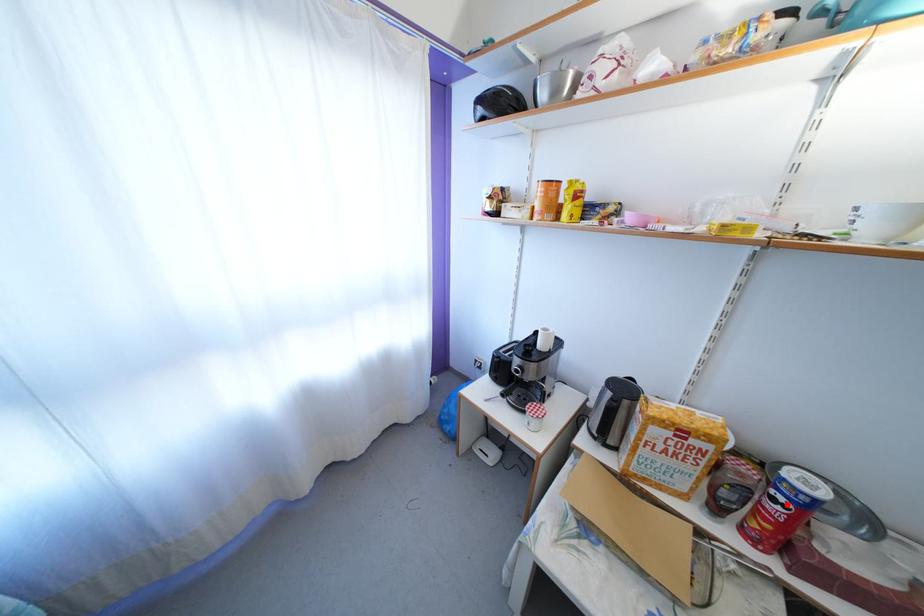
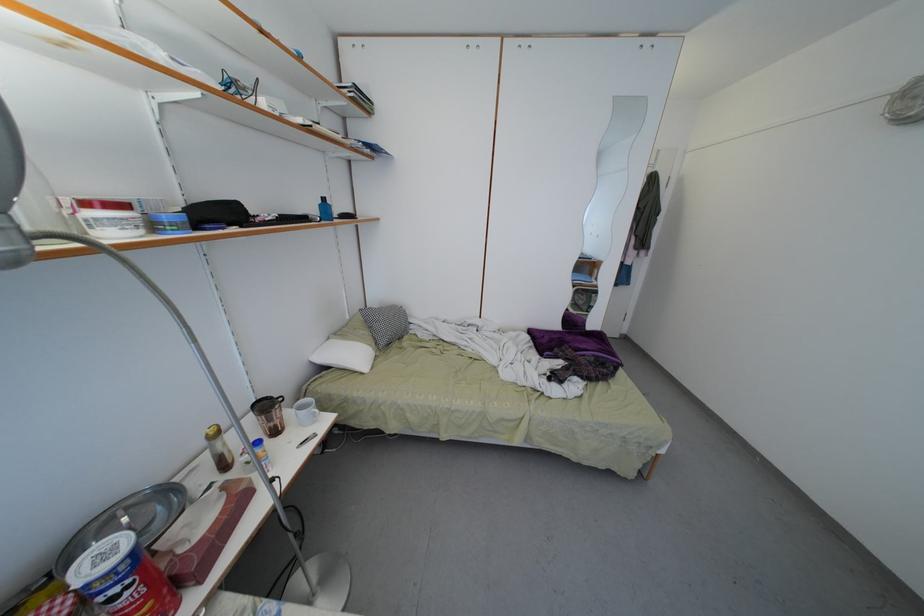
Question: I am providing you with two images of the same scene from different viewpoints. Image1 has a red point marked. In image2, the corresponding 3D location appears at what relative position? Reply with the corresponding letter.

Choices:
 (A) Closer
 (B) Farther

Answer: (B)